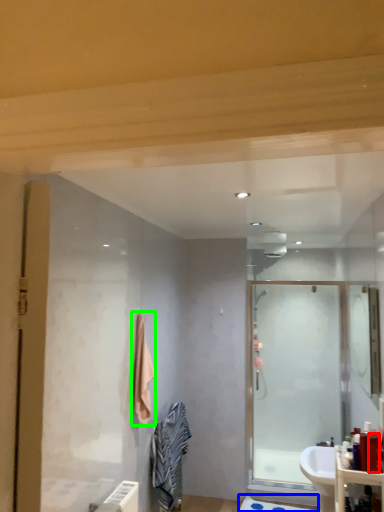
Question: Which object is the closest to the toiletry (highlighted by a red box)? Choose among these: bath mat (highlighted by a blue box) or bath towel (highlighted by a green box).

Choices:
 (A) bath mat
 (B) bath towel

Answer: (B)